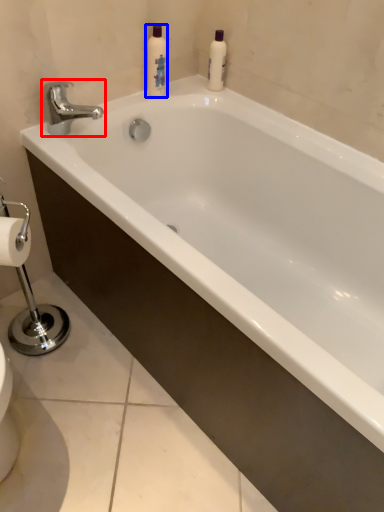
Question: Which of the following is the closest to the observer, tap (highlighted by a red box) or cleaning product (highlighted by a blue box)?

Choices:
 (A) tap
 (B) cleaning product

Answer: (A)